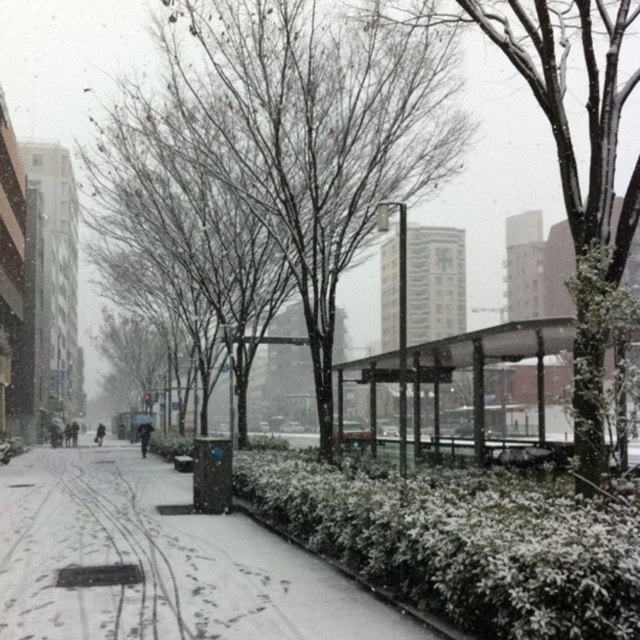
Question: Which is nearer to the transparent plastic bus stop at center?

Choices:
 (A) snow-covered concrete sidewalk at lower left
 (B) snow-covered tree at center
 (C) bare branches at center

Answer: (C)

Question: Which of these objects is positioned farthest from the transparent plastic bus stop at center?

Choices:
 (A) snow-covered concrete sidewalk at lower left
 (B) snow-covered tree at center
 (C) bare branches at center

Answer: (A)

Question: Does bare branches at center have a smaller size compared to transparent plastic bus stop at center?

Choices:
 (A) yes
 (B) no

Answer: (B)

Question: Considering the real-world distances, which object is closest to the snow-covered tree at center?

Choices:
 (A) transparent plastic bus stop at center
 (B) bare branches at center

Answer: (B)

Question: Is snow-covered concrete sidewalk at lower left in front of transparent plastic bus stop at center?

Choices:
 (A) yes
 (B) no

Answer: (B)

Question: Does snow-covered concrete sidewalk at lower left come behind transparent plastic bus stop at center?

Choices:
 (A) no
 (B) yes

Answer: (B)